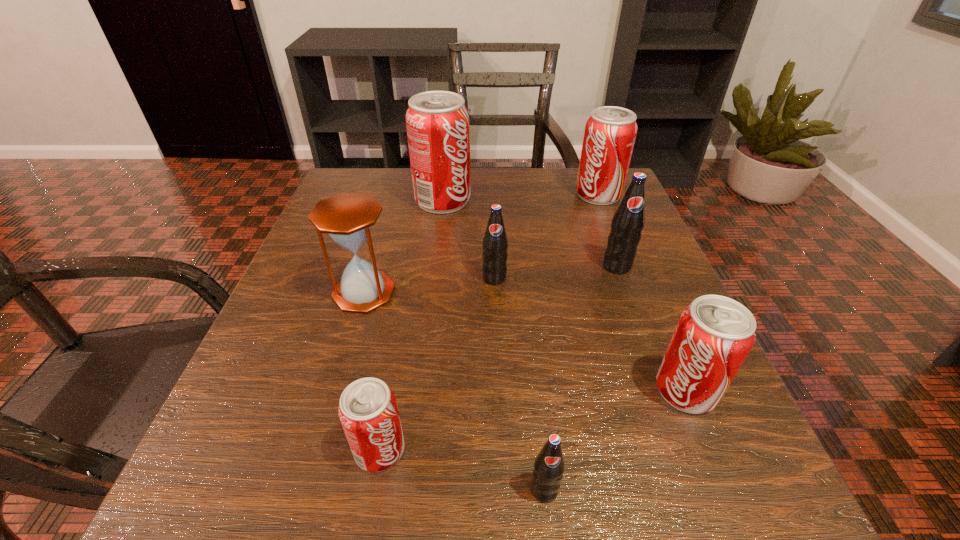
The width and height of the screenshot is (960, 540). Find the location of `the tallest pop`. the tallest pop is located at coordinates (437, 122).

At what (x,y) coordinates should I click in order to perform the action: click on the biggest red soda can. Please return your answer as a coordinate pair (x, y). The height and width of the screenshot is (540, 960). Looking at the image, I should click on (437, 122).

Locate an element on the screen. The height and width of the screenshot is (540, 960). the third smallest red soda can is located at coordinates (610, 132).

What are the coordinates of `the rightmost black pop` in the screenshot? It's located at (628, 221).

What are the coordinates of `hourglass` in the screenshot? It's located at (347, 218).

Locate an element on the screen. the fourth object from left to right is located at coordinates (495, 243).

You are a GUI agent. You are given a task and a screenshot of the screen. Output one action in this format:
    pyautogui.click(x=<x>, y=<y>)
    Task: Click on the second biggest black pop
    The image size is (960, 540).
    Given the screenshot: What is the action you would take?
    pyautogui.click(x=495, y=243)

Locate an element on the screen. Image resolution: width=960 pixels, height=540 pixels. the third farthest red soda can is located at coordinates (714, 334).

Where is `the second smallest red soda can`? This screenshot has width=960, height=540. the second smallest red soda can is located at coordinates (714, 334).

Where is `the sixth farthest pop`? This screenshot has height=540, width=960. the sixth farthest pop is located at coordinates (368, 411).